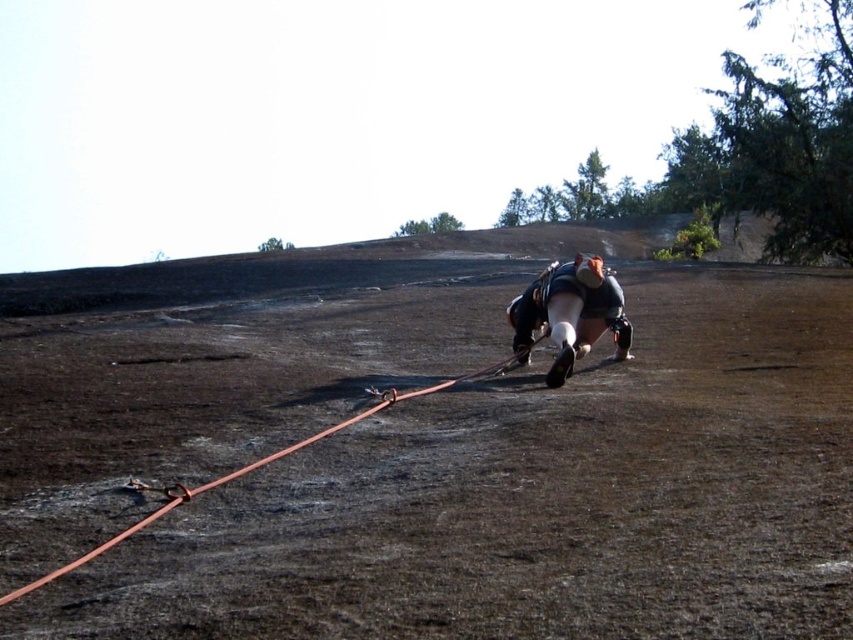
How distant is brown matte dirt field at center from matte black helmet at center?

brown matte dirt field at center is 13.06 feet away from matte black helmet at center.

Looking at this image, measure the distance between brown matte dirt field at center and camera.

brown matte dirt field at center and camera are 2.70 meters apart from each other.

Locate an element on the screen. The height and width of the screenshot is (640, 853). brown matte dirt field at center is located at coordinates click(x=537, y=499).

Does matte black helmet at center have a greater width compared to orange rubber rope at lower left?

Incorrect, matte black helmet at center's width does not surpass orange rubber rope at lower left's.

Consider the image. Which of these two, matte black helmet at center or orange rubber rope at lower left, stands shorter?

Standing shorter between the two is orange rubber rope at lower left.

Is point (515, 346) less distant than point (184, 496)?

No, (515, 346) is behind (184, 496).

At what (x,y) coordinates should I click in order to perform the action: click on matte black helmet at center. Please return your answer as a coordinate pair (x, y). The height and width of the screenshot is (640, 853). Looking at the image, I should click on (570, 314).

From the picture: Is brown matte dirt field at center thinner than orange rubber rope at lower left?

Incorrect, brown matte dirt field at center's width is not less than orange rubber rope at lower left's.

Is brown matte dirt field at center wider than orange rubber rope at lower left?

Indeed, brown matte dirt field at center has a greater width compared to orange rubber rope at lower left.

Does point (129, 388) come in front of point (100, 550)?

No, (129, 388) is further to viewer.

Locate an element on the screen. brown matte dirt field at center is located at coordinates (537, 499).